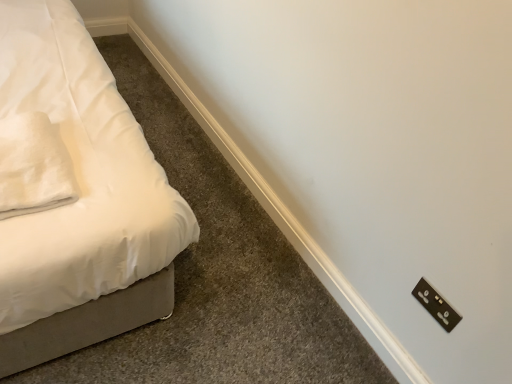
What is the approximate height of white soft fabric pillow at left?

Result: 3.46 inches.

What do you see at coordinates (33, 166) in the screenshot? Image resolution: width=512 pixels, height=384 pixels. I see `white soft fabric pillow at left` at bounding box center [33, 166].

This screenshot has width=512, height=384. In order to click on white soft fabric pillow at left in this screenshot , I will do `click(33, 166)`.

Locate an element on the screen. The width and height of the screenshot is (512, 384). black plastic light switch at lower right is located at coordinates (436, 305).

What do you see at coordinates (436, 305) in the screenshot?
I see `black plastic light switch at lower right` at bounding box center [436, 305].

Identify the location of white soft fabric pillow at left. This screenshot has width=512, height=384. (33, 166).

Consider the image. Which is more to the right, white soft fabric pillow at left or black plastic light switch at lower right?

Positioned to the right is black plastic light switch at lower right.

Considering the positions of objects white soft fabric pillow at left and black plastic light switch at lower right in the image provided, who is in front, white soft fabric pillow at left or black plastic light switch at lower right?

white soft fabric pillow at left is in front.

Is point (22, 146) positioned behind point (414, 293)?

That is False.

From the image's perspective, which is above, white soft fabric pillow at left or black plastic light switch at lower right?

white soft fabric pillow at left, from the image's perspective.

Consider the image. From a real-world perspective, is white soft fabric pillow at left under black plastic light switch at lower right?

No, from a real-world perspective, white soft fabric pillow at left is not beneath black plastic light switch at lower right.

Considering the sizes of objects white soft fabric pillow at left and black plastic light switch at lower right in the image provided, who is thinner, white soft fabric pillow at left or black plastic light switch at lower right?

black plastic light switch at lower right is thinner.

Considering the relative sizes of white soft fabric pillow at left and black plastic light switch at lower right in the image provided, is white soft fabric pillow at left taller than black plastic light switch at lower right?

Incorrect, the height of white soft fabric pillow at left is not larger of that of black plastic light switch at lower right.

Does white soft fabric pillow at left have a smaller size compared to black plastic light switch at lower right?

No, white soft fabric pillow at left is not smaller than black plastic light switch at lower right.

Is black plastic light switch at lower right located within white soft fabric pillow at left?

No, white soft fabric pillow at left does not contain black plastic light switch at lower right.

Is white soft fabric pillow at left not near black plastic light switch at lower right?

That's right, there is a large distance between white soft fabric pillow at left and black plastic light switch at lower right.

Does white soft fabric pillow at left turn towards black plastic light switch at lower right?

No, white soft fabric pillow at left is not turned towards black plastic light switch at lower right.

Consider the image. Can you tell me how much white soft fabric pillow at left and black plastic light switch at lower right differ in facing direction?

The facing directions of white soft fabric pillow at left and black plastic light switch at lower right are 86.8 degrees apart.

Locate an element on the screen. This screenshot has height=384, width=512. pillow above the black plastic light switch at lower right (from a real-world perspective) is located at coordinates (x=33, y=166).

Considering the relative positions of black plastic light switch at lower right and white soft fabric pillow at left in the image provided, is black plastic light switch at lower right to the left or to the right of white soft fabric pillow at left?

In the image, black plastic light switch at lower right appears on the right side of white soft fabric pillow at left.

Is black plastic light switch at lower right in front of white soft fabric pillow at left?

That is False.

Is point (417, 294) in front of point (50, 186)?

No, it is behind (50, 186).

From the image's perspective, which object appears higher, black plastic light switch at lower right or white soft fabric pillow at left?

white soft fabric pillow at left appears higher in the image.

From a real-world perspective, relative to white soft fabric pillow at left, is black plastic light switch at lower right vertically above or below?

From a real-world perspective, black plastic light switch at lower right is physically below white soft fabric pillow at left.

Considering the relative sizes of black plastic light switch at lower right and white soft fabric pillow at left in the image provided, is black plastic light switch at lower right wider than white soft fabric pillow at left?

Incorrect, the width of black plastic light switch at lower right does not surpass that of white soft fabric pillow at left.

Is black plastic light switch at lower right shorter than white soft fabric pillow at left?

No, black plastic light switch at lower right is not shorter than white soft fabric pillow at left.

Can you confirm if black plastic light switch at lower right is smaller than white soft fabric pillow at left?

Correct, black plastic light switch at lower right occupies less space than white soft fabric pillow at left.

Which is correct: black plastic light switch at lower right is inside white soft fabric pillow at left, or outside of it?

black plastic light switch at lower right lies outside white soft fabric pillow at left.

Can you see black plastic light switch at lower right touching white soft fabric pillow at left?

black plastic light switch at lower right is not next to white soft fabric pillow at left, and they're not touching.

From the picture: Is black plastic light switch at lower right oriented towards white soft fabric pillow at left?

No, black plastic light switch at lower right is not aimed at white soft fabric pillow at left.

How far apart are black plastic light switch at lower right and white soft fabric pillow at left?

They are 1.09 meters apart.

The width and height of the screenshot is (512, 384). I want to click on pillow above the black plastic light switch at lower right (from a real-world perspective), so pyautogui.click(x=33, y=166).

Where is `pillow on the left of black plastic light switch at lower right`? The image size is (512, 384). pillow on the left of black plastic light switch at lower right is located at coordinates (33, 166).

Identify the location of light switch below the white soft fabric pillow at left (from the image's perspective). This screenshot has width=512, height=384. (436, 305).